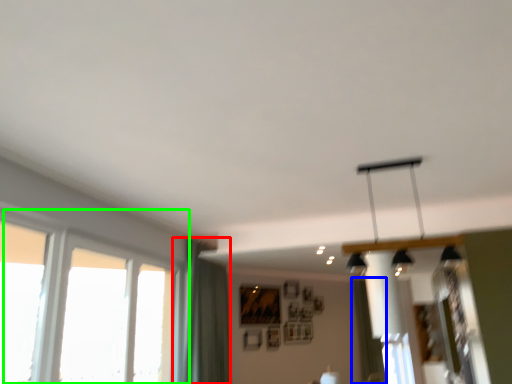
Question: Considering the real-world distances, which object is closest to curtain (highlighted by a red box)? curtain (highlighted by a blue box) or window (highlighted by a green box).

Choices:
 (A) curtain
 (B) window

Answer: (B)